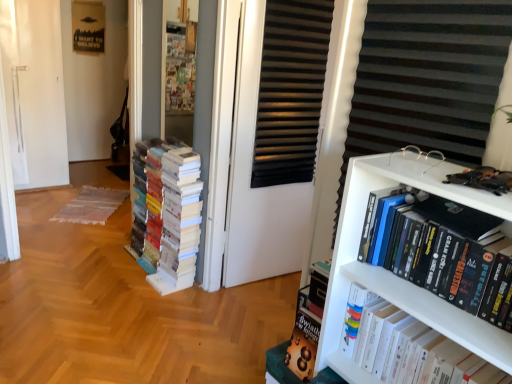
Question: Considering the positions of point click(487, 350) and point click(445, 274), is point click(487, 350) closer or farther from the camera than point click(445, 274)?

Choices:
 (A) closer
 (B) farther

Answer: (A)

Question: In terms of height, does hardcover book at upper right, the second book from the back, look taller or shorter compared to hardcover books at right, which is counted as the first book, starting from the front?

Choices:
 (A) tall
 (B) short

Answer: (A)

Question: Estimate the real-world distances between objects in this image. Which object is farther from the hardcover books at right, positioned as the first book in right-to-left order?

Choices:
 (A) white paper books at left, placed as the third book when sorted from right to left
 (B) white plastic bookcase at right
 (C) black matte screen door at center
 (D) hardcover book at upper right, which is the second book in right-to-left order

Answer: (A)

Question: Which object is the closest to the black matte screen door at center?

Choices:
 (A) white paper books at left, which is the third book from front to back
 (B) hardcover books at right, the third book positioned from the left
 (C) white plastic bookcase at right
 (D) hardcover book at upper right, positioned as the 2th book in left-to-right order

Answer: (A)